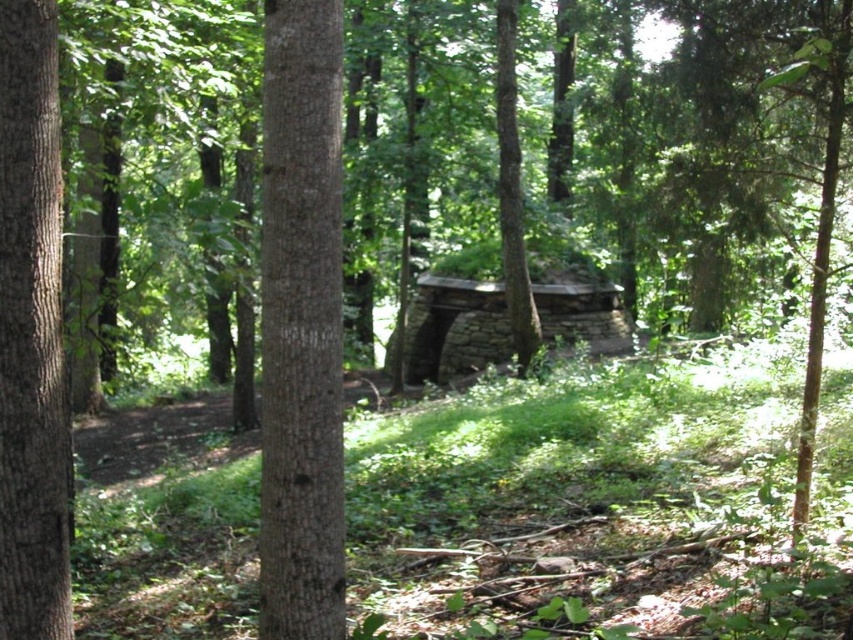
Question: Considering the relative positions of rustic stone log cabin at center and brown rough bark tree at center in the image provided, where is rustic stone log cabin at center located with respect to brown rough bark tree at center?

Choices:
 (A) right
 (B) left

Answer: (B)

Question: Can you confirm if brown rough bark tree at left is wider than rustic stone log cabin at center?

Choices:
 (A) no
 (B) yes

Answer: (A)

Question: Can you confirm if smooth brown tree trunk at center is smaller than brown rough bark tree at left?

Choices:
 (A) yes
 (B) no

Answer: (B)

Question: Which point appears farthest from the camera in this image?

Choices:
 (A) (25, 269)
 (B) (556, 298)
 (C) (283, 582)

Answer: (B)

Question: Which point appears farthest from the camera in this image?

Choices:
 (A) (505, 285)
 (B) (44, 230)
 (C) (462, 304)

Answer: (C)

Question: Which object is the farthest from the smooth brown tree trunk at center?

Choices:
 (A) brown rough bark tree at center
 (B) rustic stone log cabin at center
 (C) brown rough bark tree at left

Answer: (B)